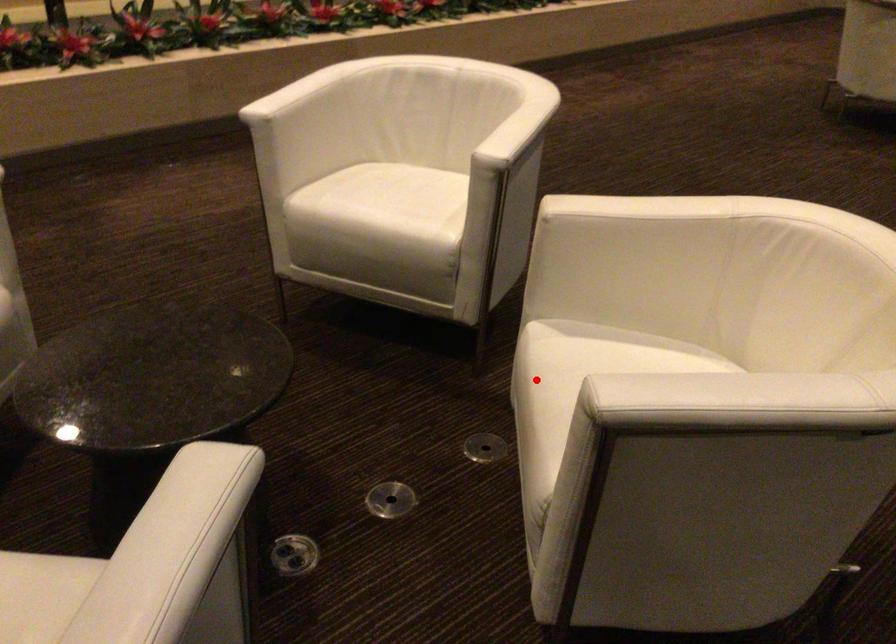
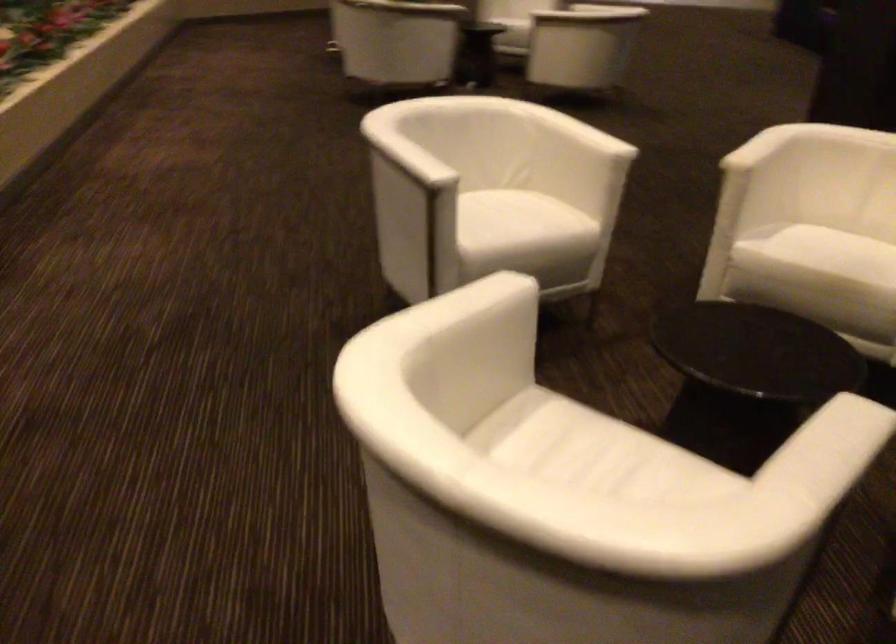
Question: I am providing you with two images of the same scene from different viewpoints. A red point is shown in image1. For the corresponding object point in image2, is it positioned nearer or farther from the camera?

Choices:
 (A) Nearer
 (B) Farther

Answer: (B)